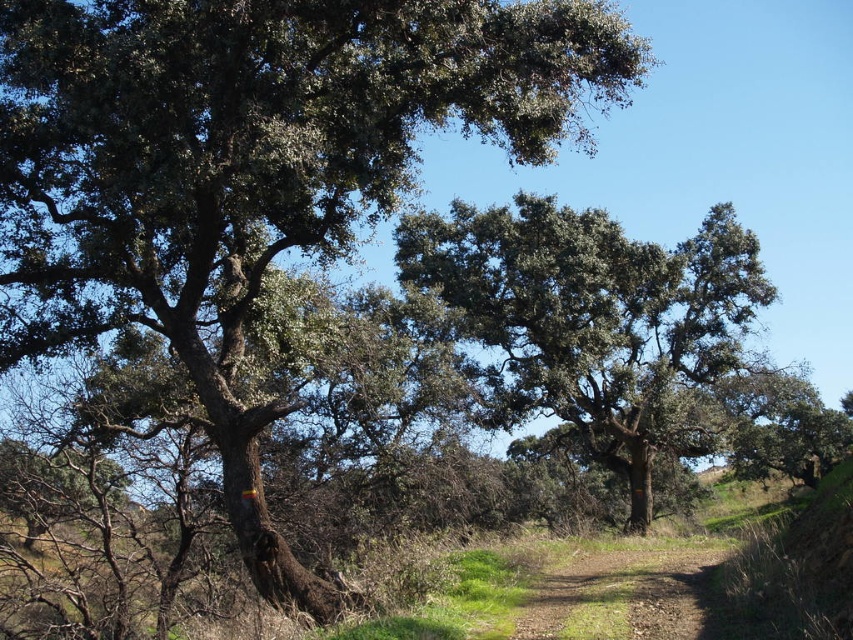
You are a hiker trying to decide whether to walk around the green leafy tree at center or take the brown dirt track at center. Based on their widths, which path would you choose and why?

The green leafy tree at center might be wider than brown dirt track at center, so it might be better to take the brown dirt track at center since it could be narrower and safer to navigate around the tree.

You are a hiker trying to navigate a semi arid landscape. You see a green leafy tree at center and a brown dirt track at center. Which object is taller?

The green leafy tree at center is taller than the brown dirt track at center.

You are standing at the edge of the scene and want to walk along the brown dirt track at center. Which direction should you look to see the green leafy tree at center blocking your view?

The green leafy tree at center is located above the brown dirt track at center, so you should look upward to see the green leafy tree at center blocking your view while walking along the track.